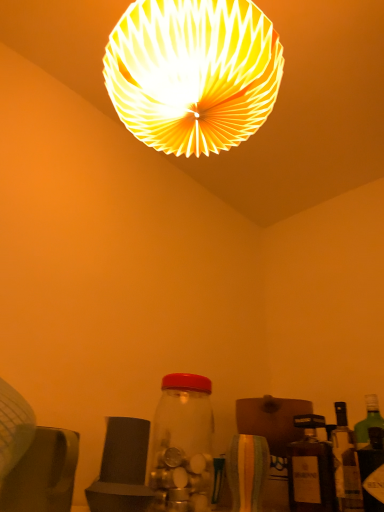
Question: From the image's perspective, is white paper lampshade at upper center on transparent glass jar at center, the first bottle when ordered from left to right?

Choices:
 (A) yes
 (B) no

Answer: (A)

Question: From a real-world perspective, is white paper lampshade at upper center located higher than transparent glass jar at center, the 3th bottle in the right-to-left sequence?

Choices:
 (A) no
 (B) yes

Answer: (B)

Question: From a real-world perspective, is white paper lampshade at upper center under transparent glass jar at center, the 3th bottle in the right-to-left sequence?

Choices:
 (A) no
 (B) yes

Answer: (A)

Question: Would you consider white paper lampshade at upper center to be distant from transparent glass jar at center, the 3th bottle in the right-to-left sequence?

Choices:
 (A) yes
 (B) no

Answer: (B)

Question: Is white paper lampshade at upper center oriented away from transparent glass jar at center, the first bottle when ordered from left to right?

Choices:
 (A) no
 (B) yes

Answer: (A)

Question: Is white paper lampshade at upper center behind transparent glass jar at center, the 3th bottle in the right-to-left sequence?

Choices:
 (A) no
 (B) yes

Answer: (A)

Question: Considering the relative sizes of green glass bottle at right, which is the first bottle from right to left, and white paper lampshade at upper center in the image provided, is green glass bottle at right, which is the first bottle from right to left, smaller than white paper lampshade at upper center?

Choices:
 (A) yes
 (B) no

Answer: (A)

Question: Is green glass bottle at right, the 3th bottle positioned from the left, outside of white paper lampshade at upper center?

Choices:
 (A) no
 (B) yes

Answer: (B)

Question: Is green glass bottle at right, the 3th bottle positioned from the left, to the right of white paper lampshade at upper center from the viewer's perspective?

Choices:
 (A) no
 (B) yes

Answer: (B)

Question: Does green glass bottle at right, the 3th bottle positioned from the left, turn towards white paper lampshade at upper center?

Choices:
 (A) no
 (B) yes

Answer: (A)

Question: Is the position of green glass bottle at right, the 3th bottle positioned from the left, more distant than that of white paper lampshade at upper center?

Choices:
 (A) yes
 (B) no

Answer: (A)

Question: Can you confirm if green glass bottle at right, the 3th bottle positioned from the left, is bigger than white paper lampshade at upper center?

Choices:
 (A) yes
 (B) no

Answer: (B)

Question: Is transparent glass jar at center, the 3th bottle in the right-to-left sequence, further to camera compared to white paper lampshade at upper center?

Choices:
 (A) no
 (B) yes

Answer: (B)